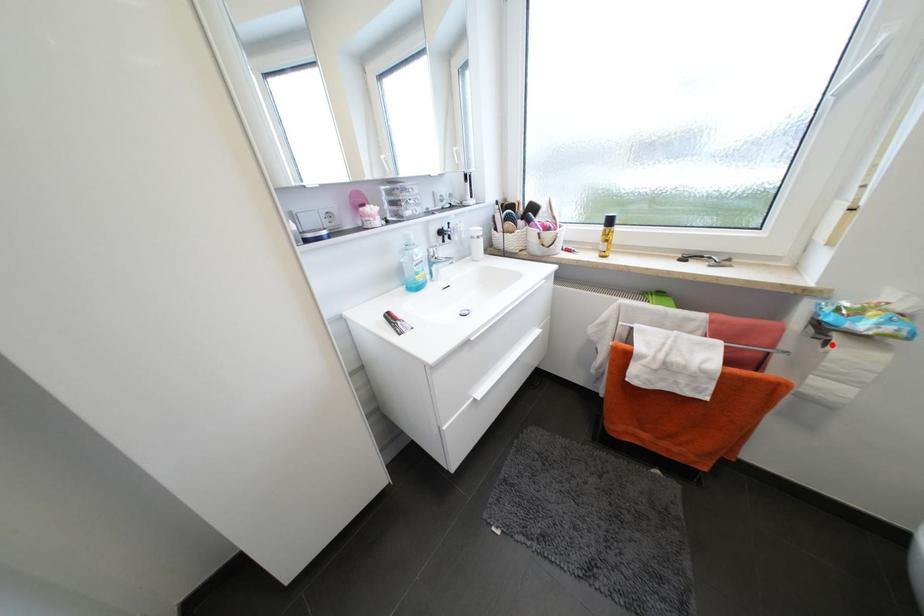
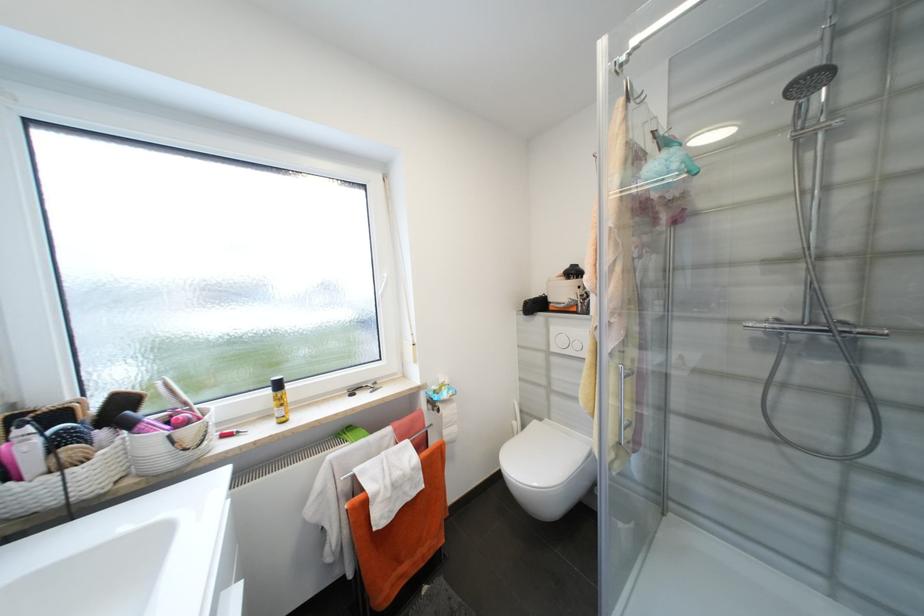
Question: I am providing you with two images of the same scene from different viewpoints. Given a red point in image1, look at the same physical point in image2. Is it:

Choices:
 (A) Closer to the viewpoint
 (B) Farther from the viewpoint

Answer: (B)